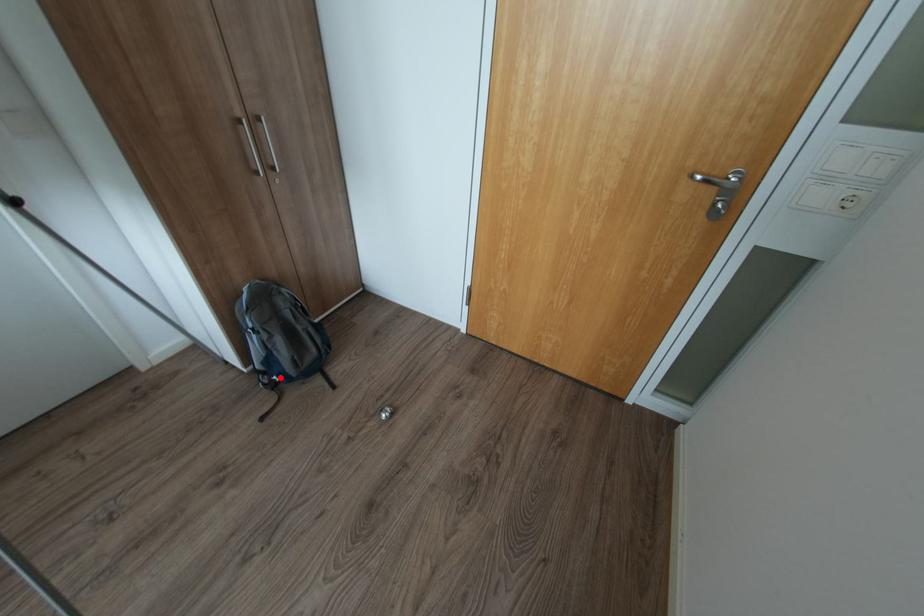
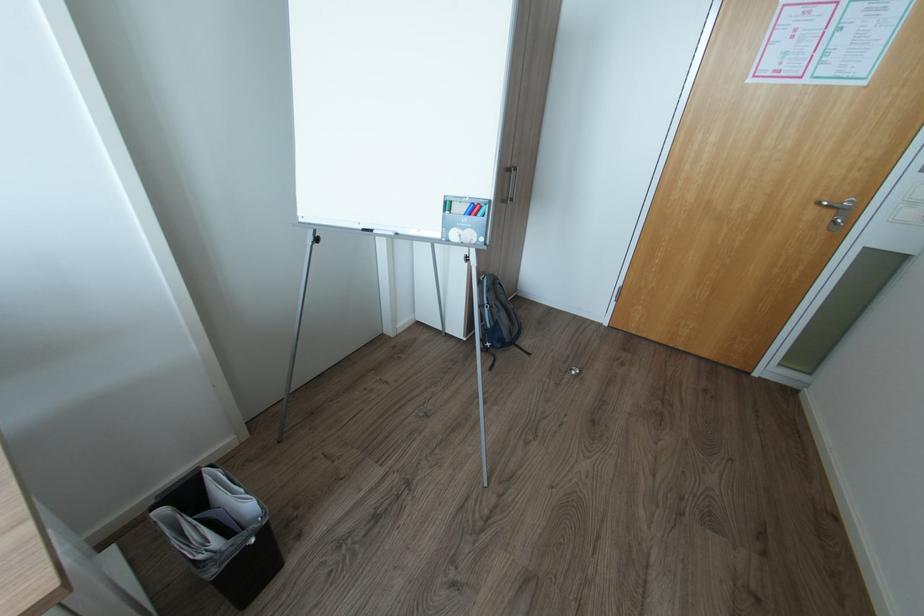
Question: I am providing you with two images of the same scene from different viewpoints. Image1 has a red point marked. In image2, the corresponding 3D location appears at what relative position? Reply with the corresponding letter.

Choices:
 (A) Closer
 (B) Farther

Answer: (A)